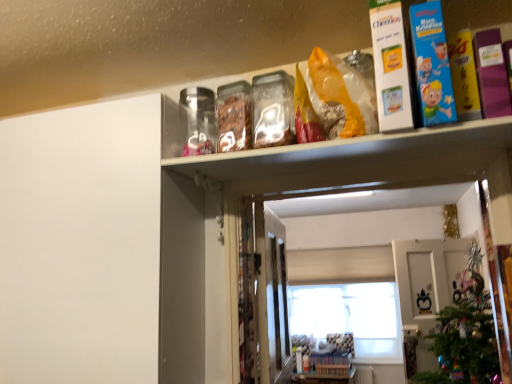
Question: From a real-world perspective, is green matte christmas tree at lower right positioned under blue cardboard box at upper right, acting as the 2th book starting from the left, based on gravity?

Choices:
 (A) no
 (B) yes

Answer: (B)

Question: Is green matte christmas tree at lower right oriented away from blue cardboard box at upper right, acting as the 2th book starting from the left?

Choices:
 (A) yes
 (B) no

Answer: (B)

Question: Does green matte christmas tree at lower right have a greater width compared to blue cardboard box at upper right, acting as the 2th book starting from the left?

Choices:
 (A) yes
 (B) no

Answer: (B)

Question: Is green matte christmas tree at lower right at the left side of blue cardboard box at upper right, acting as the 2th book starting from the left?

Choices:
 (A) no
 (B) yes

Answer: (A)

Question: Is green matte christmas tree at lower right far from blue cardboard box at upper right, the second book viewed from the right?

Choices:
 (A) no
 (B) yes

Answer: (B)

Question: Looking at their shapes, would you say clear plastic shelf at upper center is wider or thinner than blue cardboard box at upper right, the second book viewed from the right?

Choices:
 (A) wide
 (B) thin

Answer: (A)

Question: Is clear plastic shelf at upper center taller or shorter than blue cardboard box at upper right, acting as the 2th book starting from the left?

Choices:
 (A) short
 (B) tall

Answer: (A)

Question: Is clear plastic shelf at upper center to the left or to the right of blue cardboard box at upper right, acting as the 2th book starting from the left, in the image?

Choices:
 (A) right
 (B) left

Answer: (B)

Question: From a real-world perspective, relative to blue cardboard box at upper right, the second book viewed from the right, is clear plastic shelf at upper center vertically above or below?

Choices:
 (A) below
 (B) above

Answer: (B)

Question: Considering the positions of clear plastic shelf at upper center and white cardboard box at upper right, the first book when ordered from left to right, in the image, is clear plastic shelf at upper center wider or thinner than white cardboard box at upper right, the first book when ordered from left to right,?

Choices:
 (A) thin
 (B) wide

Answer: (B)

Question: From their relative heights in the image, would you say clear plastic shelf at upper center is taller or shorter than white cardboard box at upper right, positioned as the 3th book in right-to-left order?

Choices:
 (A) short
 (B) tall

Answer: (A)

Question: Looking at the image, does clear plastic shelf at upper center seem bigger or smaller compared to white cardboard box at upper right, positioned as the 3th book in right-to-left order?

Choices:
 (A) big
 (B) small

Answer: (A)

Question: From the image's perspective, is clear plastic shelf at upper center positioned above or below white cardboard box at upper right, the first book when ordered from left to right?

Choices:
 (A) above
 (B) below

Answer: (A)

Question: Considering the positions of white matte window at center and blue cardboard box at upper right, acting as the 2th book starting from the left, in the image, is white matte window at center wider or thinner than blue cardboard box at upper right, acting as the 2th book starting from the left,?

Choices:
 (A) wide
 (B) thin

Answer: (B)

Question: Is point (389, 344) positioned closer to the camera than point (435, 31)?

Choices:
 (A) farther
 (B) closer

Answer: (A)